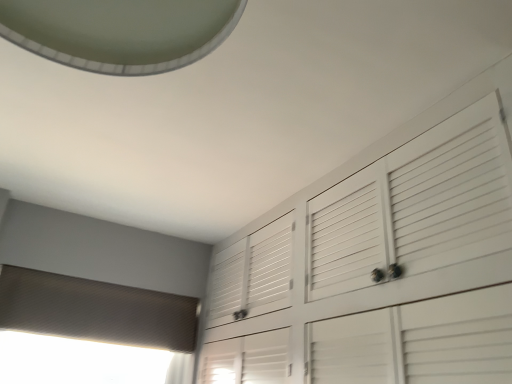
Question: Should I look upward or downward to see white glossy exhaust hood at upper left?

Choices:
 (A) up
 (B) down

Answer: (A)

Question: Is white glossy exhaust hood at upper left beside textured gray blind at lower left?

Choices:
 (A) no
 (B) yes

Answer: (A)

Question: Is white glossy exhaust hood at upper left smaller than textured gray blind at lower left?

Choices:
 (A) yes
 (B) no

Answer: (B)

Question: Is white glossy exhaust hood at upper left to the right of textured gray blind at lower left from the viewer's perspective?

Choices:
 (A) yes
 (B) no

Answer: (A)

Question: Is white glossy exhaust hood at upper left facing towards textured gray blind at lower left?

Choices:
 (A) no
 (B) yes

Answer: (A)

Question: From the image's perspective, would you say white glossy exhaust hood at upper left is shown under textured gray blind at lower left?

Choices:
 (A) no
 (B) yes

Answer: (A)

Question: Is white glossy exhaust hood at upper left further to the viewer compared to textured gray blind at lower left?

Choices:
 (A) no
 (B) yes

Answer: (A)

Question: Is textured gray blind at lower left wider than white glossy exhaust hood at upper left?

Choices:
 (A) no
 (B) yes

Answer: (A)

Question: From a real-world perspective, is textured gray blind at lower left over white glossy exhaust hood at upper left?

Choices:
 (A) yes
 (B) no

Answer: (B)

Question: Considering the relative sizes of textured gray blind at lower left and white glossy exhaust hood at upper left in the image provided, is textured gray blind at lower left taller than white glossy exhaust hood at upper left?

Choices:
 (A) yes
 (B) no

Answer: (B)

Question: Is textured gray blind at lower left bigger than white glossy exhaust hood at upper left?

Choices:
 (A) yes
 (B) no

Answer: (B)

Question: Is textured gray blind at lower left not near white glossy exhaust hood at upper left?

Choices:
 (A) yes
 (B) no

Answer: (A)

Question: Is white glossy exhaust hood at upper left surrounded by textured gray blind at lower left?

Choices:
 (A) no
 (B) yes

Answer: (A)

Question: Considering their positions, is white glossy exhaust hood at upper left located in front of or behind textured gray blind at lower left?

Choices:
 (A) behind
 (B) front

Answer: (B)